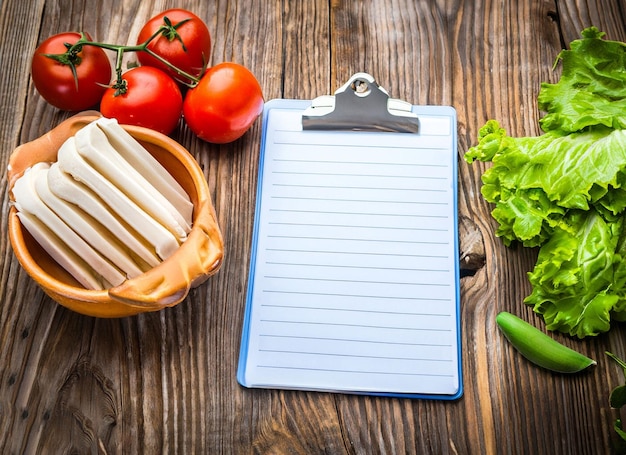
Locate an element on the screen. This screenshot has height=455, width=626. dish is located at coordinates (44, 280).